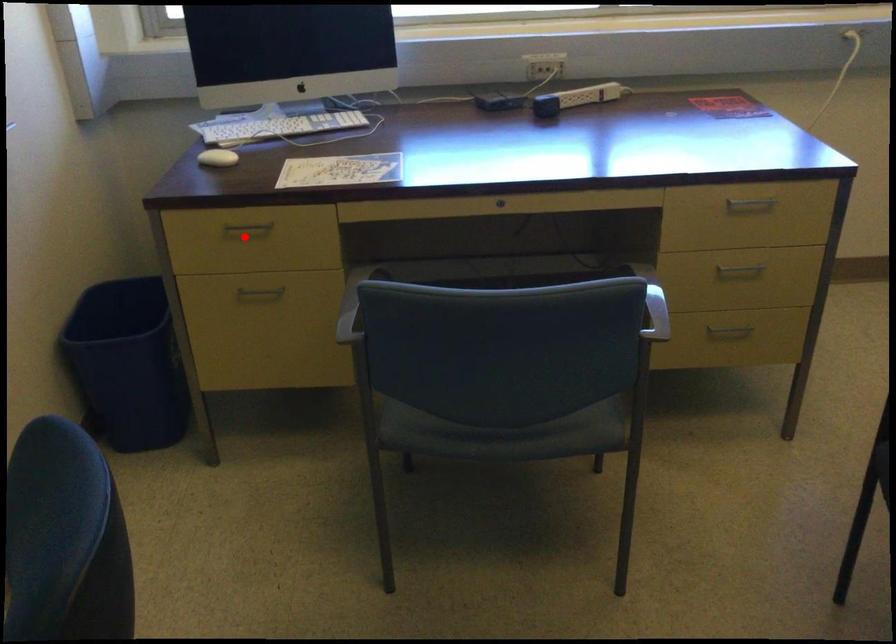
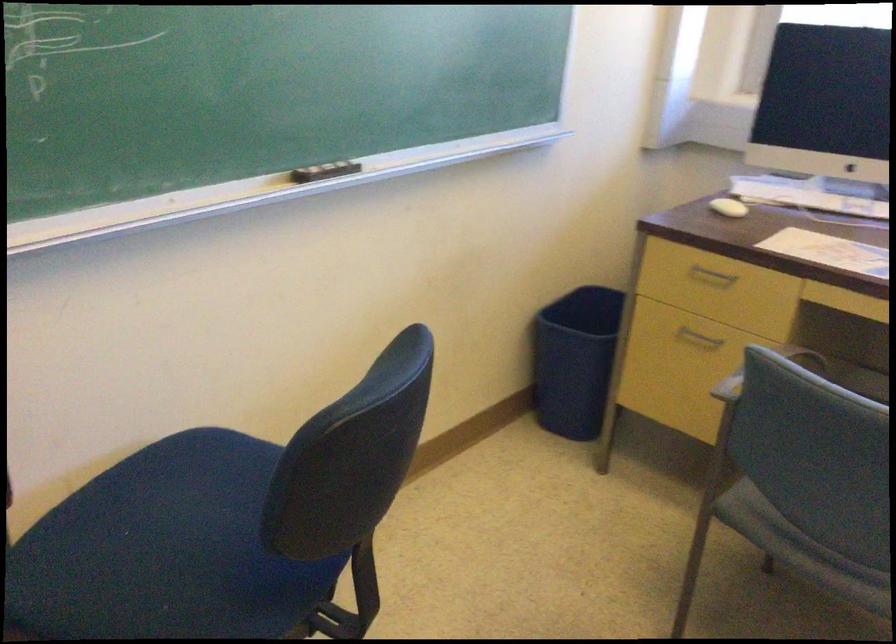
Locate, in the second image, the point that corresponds to the highlighted location in the first image.

(711, 277)